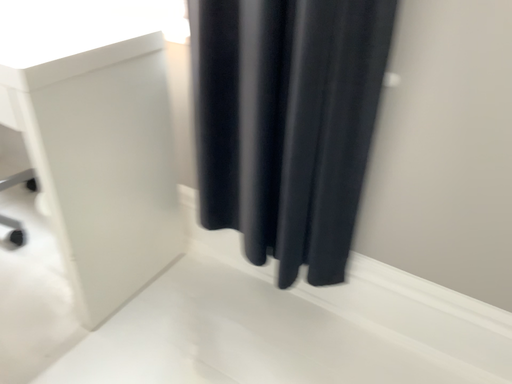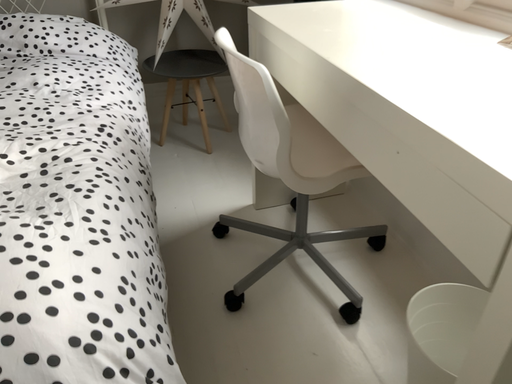
Question: How did the camera likely rotate when shooting the video?

Choices:
 (A) rotated downward
 (B) rotated upward

Answer: (B)